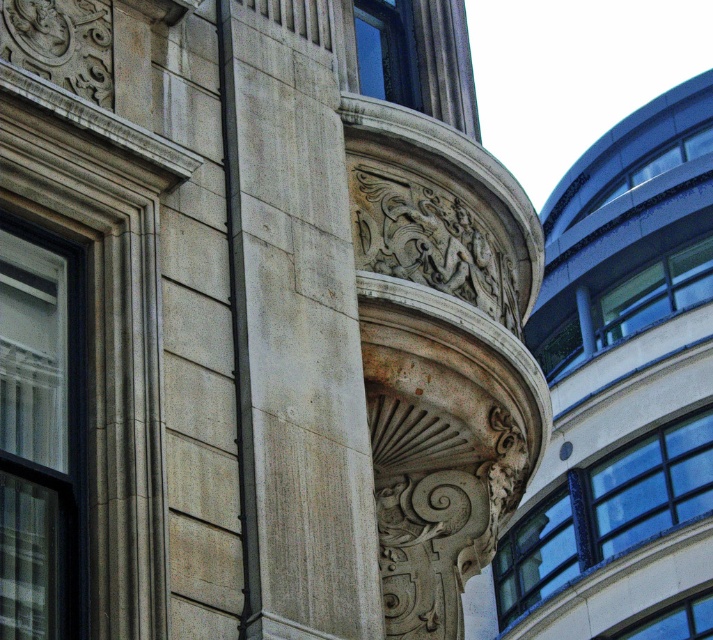
You are an architect designing a new building and want to incorporate both a smooth concrete tower at center and a light gray stone column at center. Given their sizes, which one should you place closer to the entrance to ensure visitors notice the larger structure first?

The smooth concrete tower at center has a larger width than the light gray stone column at center, so placing it closer to the entrance will make visitors notice the larger structure first.

You are an architect examining the building facade. You notice the smooth concrete tower at center and the light gray stone column at center. Which object takes up more space in the image?

The smooth concrete tower at center has a larger size compared to the light gray stone column at center, so it takes up more space in the image.

You are an architect examining the building structure. You notice the light gray stone column at center and the black metal pole at center. Which one is located higher in the structure?

The light gray stone column at center is positioned over the black metal pole at center, so it is higher up in the structure.